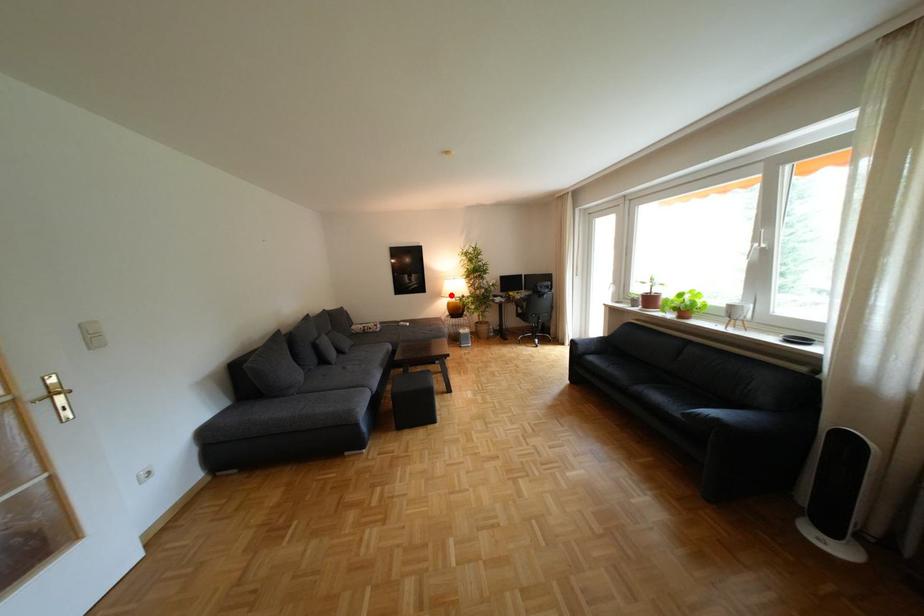
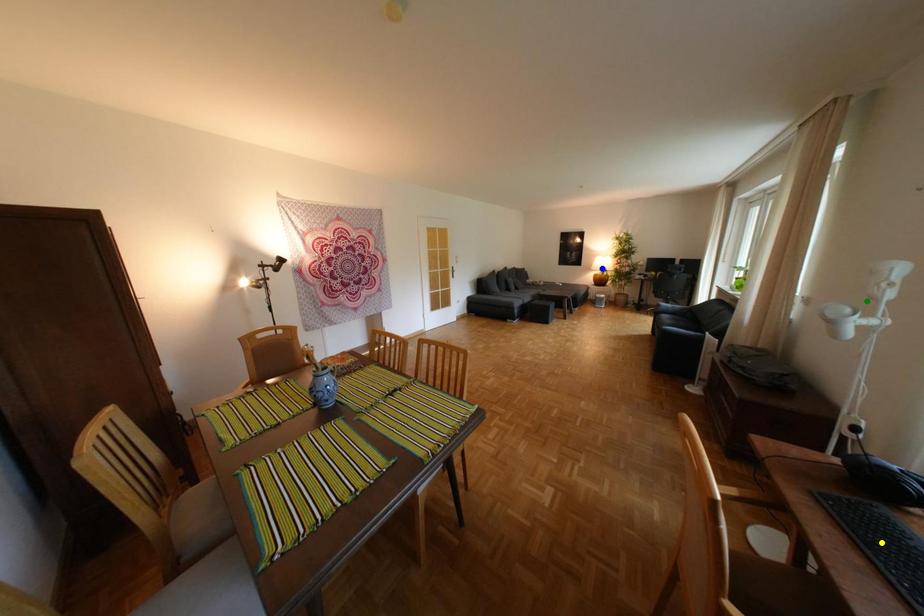
Question: I am providing you with two images of the same scene from different viewpoints. A red point is marked on the first image. You are given multiple points on the second image. Can you choose the point in image 2 that corresponds to the point in image 1?

Choices:
 (A) green point
 (B) blue point
 (C) yellow point

Answer: (B)